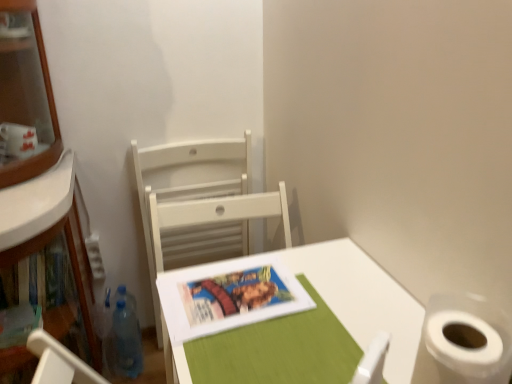
Question: Is white wood chair at center inside or outside of transparent plastic bottle at lower left?

Choices:
 (A) inside
 (B) outside

Answer: (B)

Question: Is white wood chair at center wider or thinner than transparent plastic bottle at lower left?

Choices:
 (A) wide
 (B) thin

Answer: (B)

Question: Which object is the closest to the white wood chair at center?

Choices:
 (A) white matte table at center
 (B) matte paper book cover at center
 (C) transparent plastic bottle at lower left

Answer: (C)

Question: Which is nearer to the matte paper book cover at center?

Choices:
 (A) transparent plastic bottle at lower left
 (B) white matte table at center
 (C) white wood chair at center

Answer: (B)